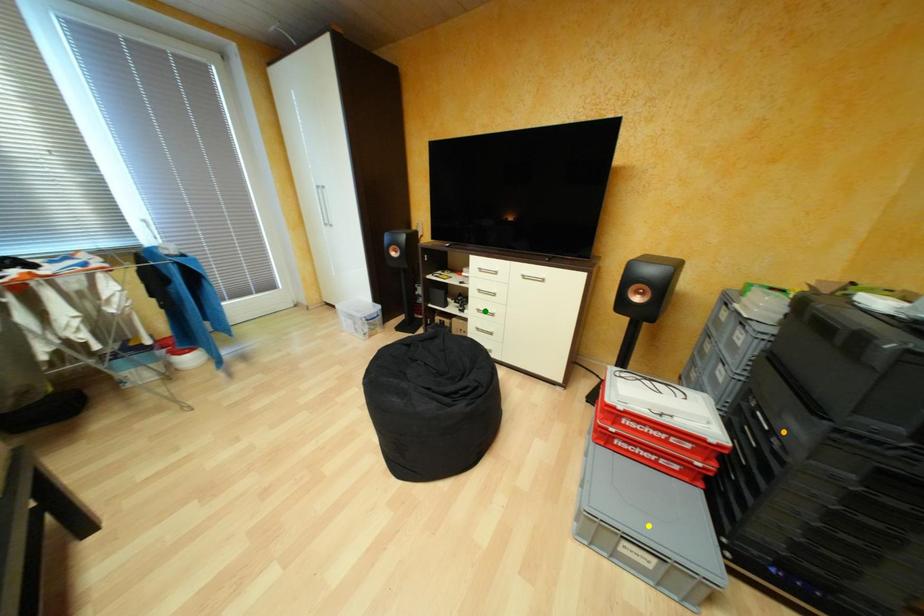
Order these from farthest to nearest:
yellow point
green point
orange point

green point
yellow point
orange point